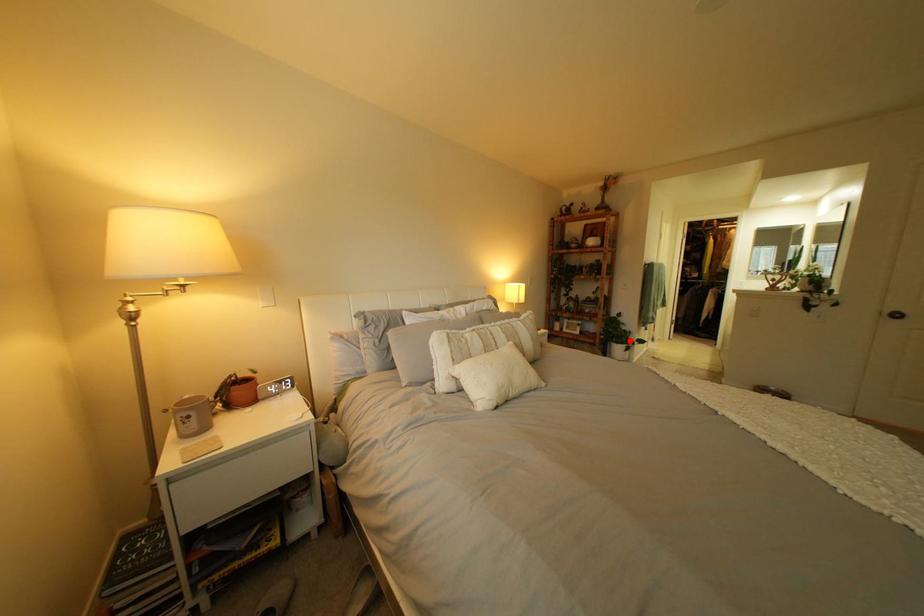
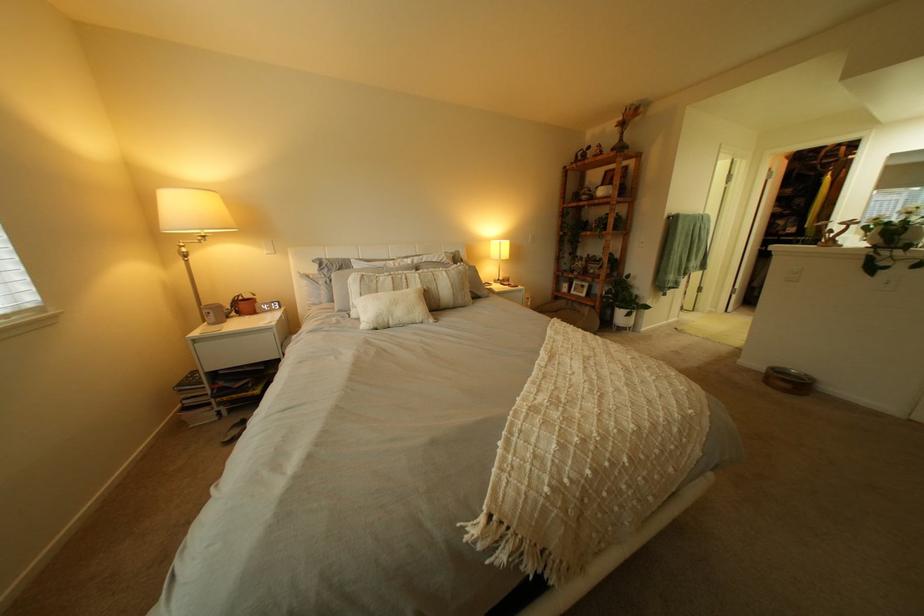
Where in the second image is the point corresponding to the highlighted location from the first image?

(633, 305)